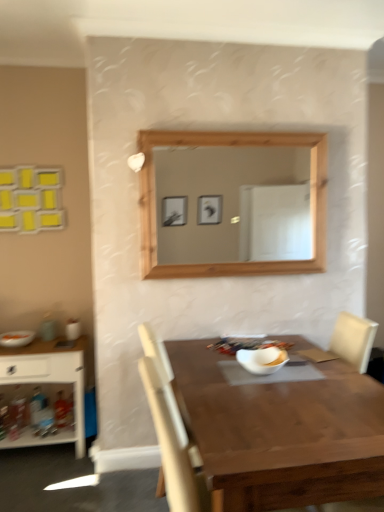
Question: Is white wood shelf at left looking in the opposite direction of matte orange bowl at left, the 2th food in the front-to-back sequence?

Choices:
 (A) no
 (B) yes

Answer: (A)

Question: Does white wood shelf at left lie behind matte orange bowl at left, which appears as the first food when viewed from the left?

Choices:
 (A) yes
 (B) no

Answer: (B)

Question: From a real-world perspective, does white wood shelf at left sit lower than matte orange bowl at left, the 2th food in the front-to-back sequence?

Choices:
 (A) yes
 (B) no

Answer: (A)

Question: Does white wood shelf at left appear on the right side of matte orange bowl at left, the 2th food in the front-to-back sequence?

Choices:
 (A) yes
 (B) no

Answer: (A)

Question: Is white wood shelf at left shorter than matte orange bowl at left, which appears as the first food when viewed from the left?

Choices:
 (A) no
 (B) yes

Answer: (A)

Question: Does point (221, 464) appear closer or farther from the camera than point (253, 372)?

Choices:
 (A) farther
 (B) closer

Answer: (B)

Question: Is wooden table at center situated inside white glossy bowl at center or outside?

Choices:
 (A) inside
 (B) outside

Answer: (B)

Question: From their relative heights in the image, would you say wooden table at center is taller or shorter than white glossy bowl at center?

Choices:
 (A) short
 (B) tall

Answer: (B)

Question: In the image, is wooden table at center on the left side or the right side of white glossy bowl at center?

Choices:
 (A) right
 (B) left

Answer: (A)

Question: From a real-world perspective, is white wood shelf at left above or below white matte bowl at center, the first food when ordered from right to left?

Choices:
 (A) above
 (B) below

Answer: (B)

Question: Is point (26, 381) positioned closer to the camera than point (274, 353)?

Choices:
 (A) closer
 (B) farther

Answer: (B)

Question: In terms of size, does white wood shelf at left appear bigger or smaller than white matte bowl at center, which appears as the second food when viewed from the back?

Choices:
 (A) big
 (B) small

Answer: (A)

Question: From the image's perspective, relative to white matte bowl at center, marked as the second food in a left-to-right arrangement, is white wood shelf at left above or below?

Choices:
 (A) above
 (B) below

Answer: (B)

Question: In terms of width, does white matte bowl at center, the first food when ordered from right to left, look wider or thinner when compared to matte orange bowl at left, which is counted as the first food, starting from the back?

Choices:
 (A) wide
 (B) thin

Answer: (B)

Question: From a real-world perspective, relative to matte orange bowl at left, which appears as the first food when viewed from the left, is white matte bowl at center, marked as the second food in a left-to-right arrangement, vertically above or below?

Choices:
 (A) below
 (B) above

Answer: (B)